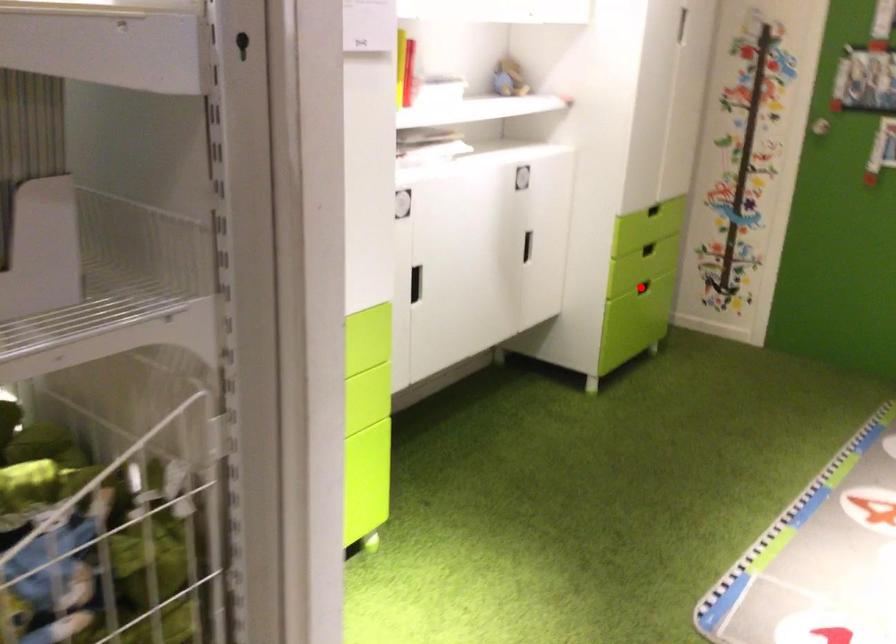
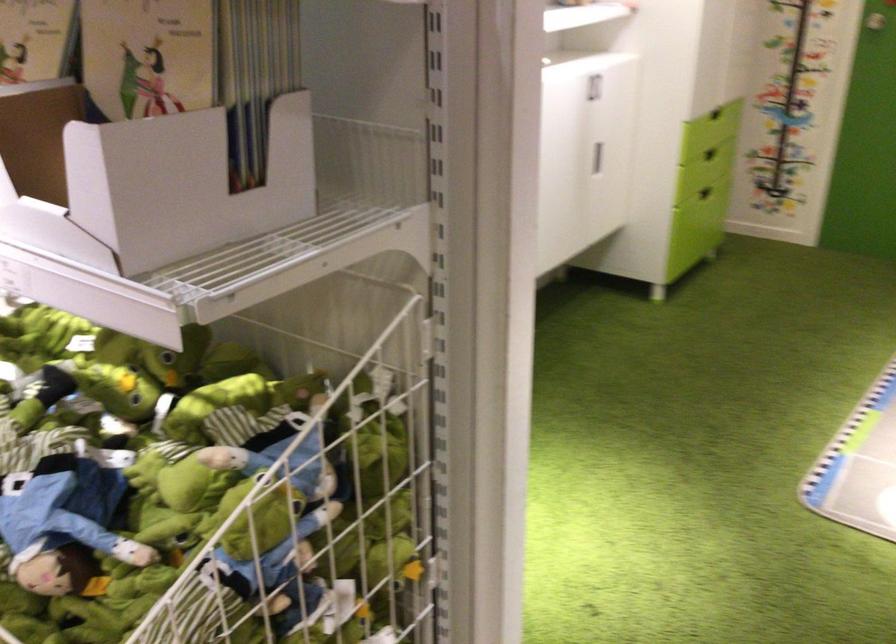
In the second image, find the point that corresponds to the highlighted location in the first image.

(704, 193)